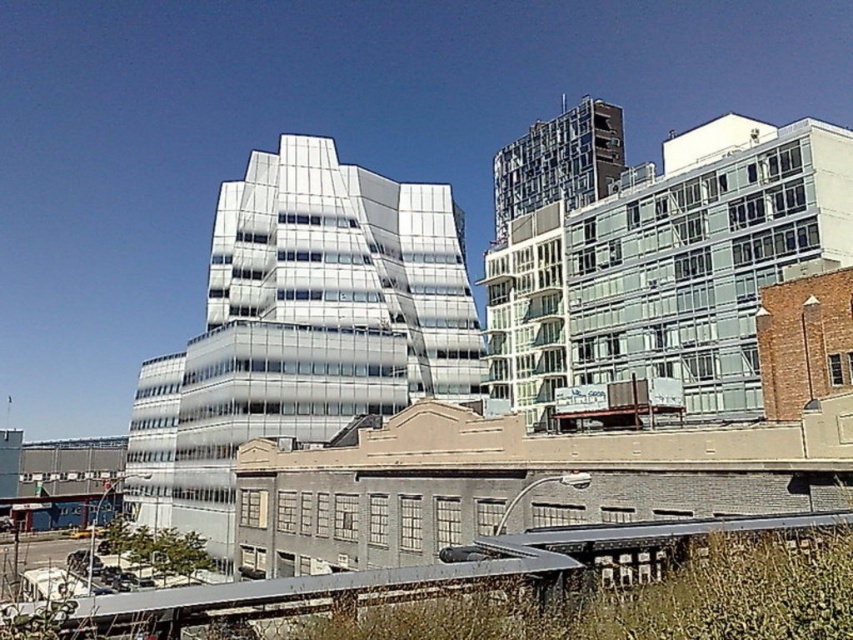
Question: Does reflective glass building at center appear under metallic gray train track at lower center?

Choices:
 (A) yes
 (B) no

Answer: (B)

Question: Is reflective glass building at center to the right of metallic gray train track at lower center from the viewer's perspective?

Choices:
 (A) yes
 (B) no

Answer: (B)

Question: Does reflective glass building at center have a greater width compared to metallic gray train track at lower center?

Choices:
 (A) no
 (B) yes

Answer: (B)

Question: Which object is closer to the camera taking this photo?

Choices:
 (A) metallic gray train track at lower center
 (B) reflective glass building at center

Answer: (A)